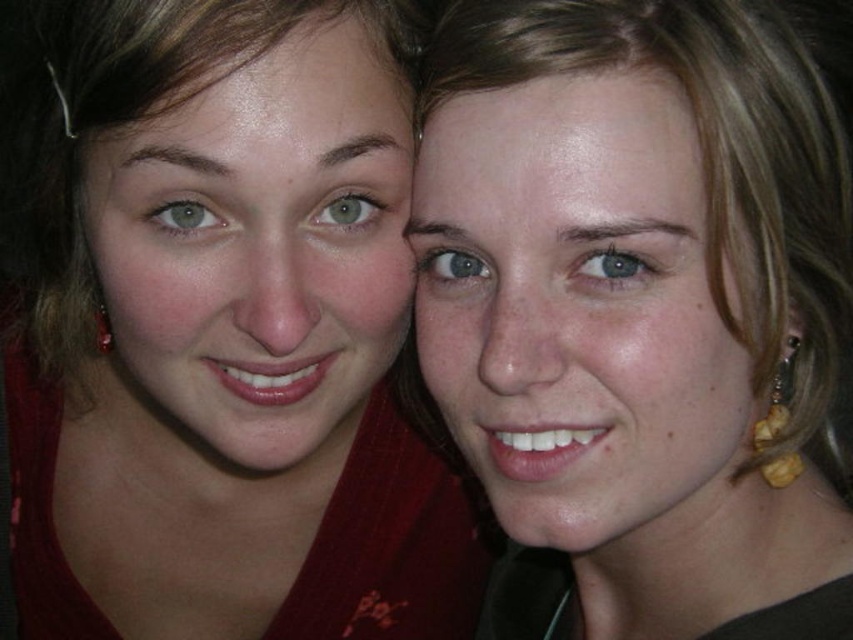
Question: From the image, what is the correct spatial relationship of matte red shirt at left in relation to matte gold earrings at right?

Choices:
 (A) above
 (B) below

Answer: (A)

Question: Does matte red shirt at left appear under matte gold earrings at right?

Choices:
 (A) no
 (B) yes

Answer: (A)

Question: Which of the following is the farthest from the observer?

Choices:
 (A) (694, 380)
 (B) (80, 330)

Answer: (B)

Question: Among these points, which one is farthest from the camera?

Choices:
 (A) (633, 339)
 (B) (357, 118)

Answer: (B)

Question: Considering the relative positions of matte red shirt at left and matte gold earrings at right in the image provided, where is matte red shirt at left located with respect to matte gold earrings at right?

Choices:
 (A) right
 (B) left

Answer: (B)

Question: Which point is closer to the camera?

Choices:
 (A) (345, 404)
 (B) (495, 358)

Answer: (B)